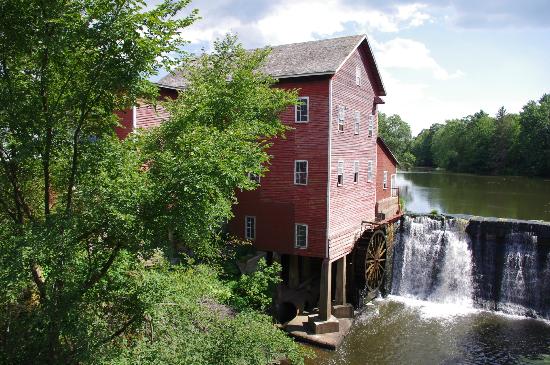
I want to click on concrete flooring, so click(x=293, y=325), click(x=329, y=342).